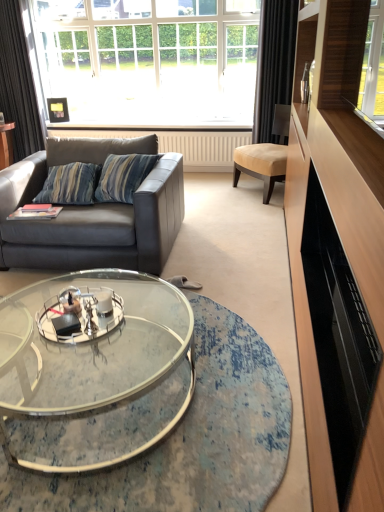
Question: Considering the relative sizes of white glass window at upper center and leather couch at left in the image provided, is white glass window at upper center taller than leather couch at left?

Choices:
 (A) yes
 (B) no

Answer: (A)

Question: Is leather couch at left completely or partially inside white glass window at upper center?

Choices:
 (A) no
 (B) yes

Answer: (A)

Question: Considering the relative positions of white glass window at upper center and leather couch at left in the image provided, is white glass window at upper center to the right of leather couch at left from the viewer's perspective?

Choices:
 (A) no
 (B) yes

Answer: (B)

Question: From a real-world perspective, is white glass window at upper center positioned under leather couch at left based on gravity?

Choices:
 (A) yes
 (B) no

Answer: (B)

Question: Is white glass window at upper center thinner than leather couch at left?

Choices:
 (A) no
 (B) yes

Answer: (B)

Question: Considering the relative sizes of white glass window at upper center and leather couch at left in the image provided, is white glass window at upper center smaller than leather couch at left?

Choices:
 (A) no
 (B) yes

Answer: (B)

Question: Is clear glass coffee table at center smaller than black fabric curtain at right, placed as the second curtain when sorted from left to right?

Choices:
 (A) yes
 (B) no

Answer: (B)

Question: Is clear glass coffee table at center taller than black fabric curtain at right, placed as the second curtain when sorted from left to right?

Choices:
 (A) yes
 (B) no

Answer: (B)

Question: Is clear glass coffee table at center wider than black fabric curtain at right, the first curtain viewed from the right?

Choices:
 (A) no
 (B) yes

Answer: (B)

Question: From a real-world perspective, is clear glass coffee table at center on black fabric curtain at right, the first curtain viewed from the right?

Choices:
 (A) no
 (B) yes

Answer: (A)

Question: Is clear glass coffee table at center oriented away from black fabric curtain at right, placed as the second curtain when sorted from left to right?

Choices:
 (A) yes
 (B) no

Answer: (B)

Question: Is clear glass coffee table at center at the right side of black fabric curtain at right, the first curtain viewed from the right?

Choices:
 (A) no
 (B) yes

Answer: (A)

Question: Considering the relative sizes of beige fabric chair at center and clear glass coffee table at center in the image provided, is beige fabric chair at center smaller than clear glass coffee table at center?

Choices:
 (A) yes
 (B) no

Answer: (A)